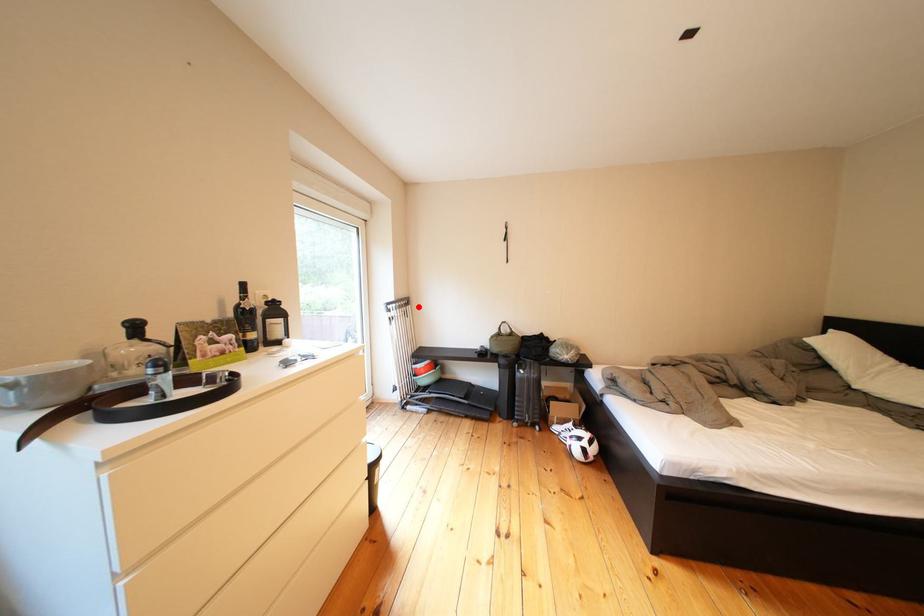
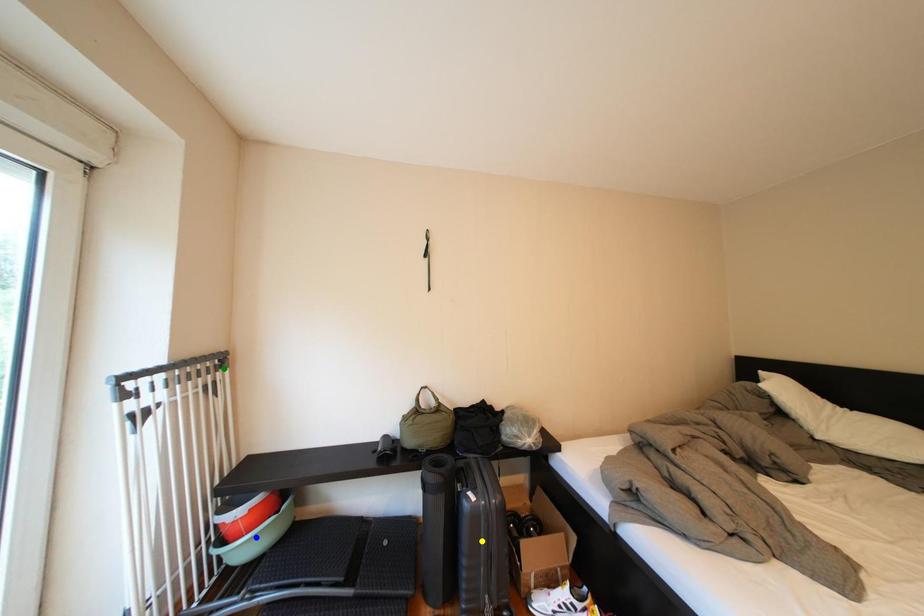
Question: I am providing you with two images of the same scene from different viewpoints. A red point is marked on the first image. You are given multiple points on the second image. Which point in image 2 is actually the same real-world point as the red point in image 1?

Choices:
 (A) blue point
 (B) yellow point
 (C) green point

Answer: (C)